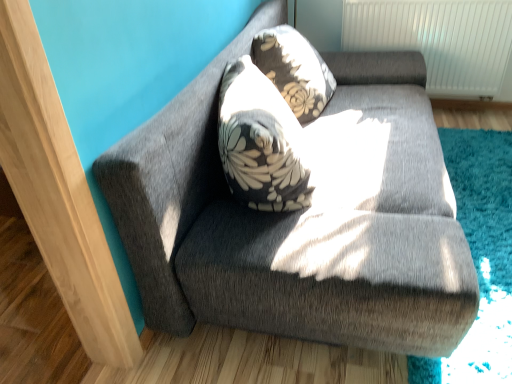
The image size is (512, 384). What do you see at coordinates (294, 70) in the screenshot?
I see `floral-patterned fabric pillow at upper center` at bounding box center [294, 70].

Where is `floral-patterned fabric pillow at upper center`? The width and height of the screenshot is (512, 384). floral-patterned fabric pillow at upper center is located at coordinates (294, 70).

Image resolution: width=512 pixels, height=384 pixels. I want to click on textured gray couch at upper center, so click(301, 217).

The image size is (512, 384). What do you see at coordinates (301, 217) in the screenshot?
I see `textured gray couch at upper center` at bounding box center [301, 217].

Where is `floral-patterned fabric pillow at upper center`? The height and width of the screenshot is (384, 512). floral-patterned fabric pillow at upper center is located at coordinates (294, 70).

Is textured gray couch at upper center to the left of floral-patterned fabric pillow at upper center from the viewer's perspective?

No.

Is the depth of textured gray couch at upper center less than that of floral-patterned fabric pillow at upper center?

Yes, it is in front of floral-patterned fabric pillow at upper center.

Is point (240, 271) farther from camera compared to point (289, 28)?

No, (240, 271) is closer to viewer.

From the image's perspective, is textured gray couch at upper center located above or below floral-patterned fabric pillow at upper center?

textured gray couch at upper center is below floral-patterned fabric pillow at upper center.

From a real-world perspective, between textured gray couch at upper center and floral-patterned fabric pillow at upper center, who is vertically higher?

floral-patterned fabric pillow at upper center.

Considering the relative sizes of textured gray couch at upper center and floral-patterned fabric pillow at upper center in the image provided, is textured gray couch at upper center thinner than floral-patterned fabric pillow at upper center?

In fact, textured gray couch at upper center might be wider than floral-patterned fabric pillow at upper center.

Is textured gray couch at upper center taller than floral-patterned fabric pillow at upper center?

Correct, textured gray couch at upper center is much taller as floral-patterned fabric pillow at upper center.

Is textured gray couch at upper center bigger than floral-patterned fabric pillow at upper center?

Correct, textured gray couch at upper center is larger in size than floral-patterned fabric pillow at upper center.

Is textured gray couch at upper center positioned beyond the bounds of floral-patterned fabric pillow at upper center?

textured gray couch at upper center is positioned outside floral-patterned fabric pillow at upper center.

Does textured gray couch at upper center touch floral-patterned fabric pillow at upper center?

No.

Is textured gray couch at upper center oriented towards floral-patterned fabric pillow at upper center?

Yes, textured gray couch at upper center faces towards floral-patterned fabric pillow at upper center.

Find the location of a particular element. throw pillow that is behind the textured gray couch at upper center is located at coordinates (294, 70).

Can you confirm if floral-patterned fabric pillow at upper center is positioned to the right of textured gray couch at upper center?

Incorrect, floral-patterned fabric pillow at upper center is not on the right side of textured gray couch at upper center.

Which object is closer to the camera taking this photo, floral-patterned fabric pillow at upper center or textured gray couch at upper center?

textured gray couch at upper center is closer to the camera.

Is point (315, 54) closer or farther from the camera than point (337, 197)?

Clearly, point (315, 54) is more distant from the camera than point (337, 197).

From the image's perspective, who appears lower, floral-patterned fabric pillow at upper center or textured gray couch at upper center?

textured gray couch at upper center.

From a real-world perspective, relative to textured gray couch at upper center, is floral-patterned fabric pillow at upper center vertically above or below?

A: floral-patterned fabric pillow at upper center is situated higher than textured gray couch at upper center in the real world.

Is floral-patterned fabric pillow at upper center wider than textured gray couch at upper center?

No, floral-patterned fabric pillow at upper center is not wider than textured gray couch at upper center.

Does floral-patterned fabric pillow at upper center have a lesser height compared to textured gray couch at upper center?

Yes, floral-patterned fabric pillow at upper center is shorter than textured gray couch at upper center.

Considering the relative sizes of floral-patterned fabric pillow at upper center and textured gray couch at upper center in the image provided, is floral-patterned fabric pillow at upper center smaller than textured gray couch at upper center?

Correct, floral-patterned fabric pillow at upper center occupies less space than textured gray couch at upper center.

Is floral-patterned fabric pillow at upper center inside the boundaries of textured gray couch at upper center, or outside?

floral-patterned fabric pillow at upper center is contained in textured gray couch at upper center.

Is there a large distance between floral-patterned fabric pillow at upper center and textured gray couch at upper center?

No, floral-patterned fabric pillow at upper center is in close proximity to textured gray couch at upper center.

Could you tell me if floral-patterned fabric pillow at upper center is turned towards textured gray couch at upper center?

Yes, floral-patterned fabric pillow at upper center is aimed at textured gray couch at upper center.

Where is `throw pillow on the left of textured gray couch at upper center`? This screenshot has width=512, height=384. throw pillow on the left of textured gray couch at upper center is located at coordinates (294, 70).

Where is `throw pillow on the left of textured gray couch at upper center`? The width and height of the screenshot is (512, 384). throw pillow on the left of textured gray couch at upper center is located at coordinates (294, 70).

Locate an element on the screen. The image size is (512, 384). studio couch below the floral-patterned fabric pillow at upper center (from a real-world perspective) is located at coordinates (301, 217).